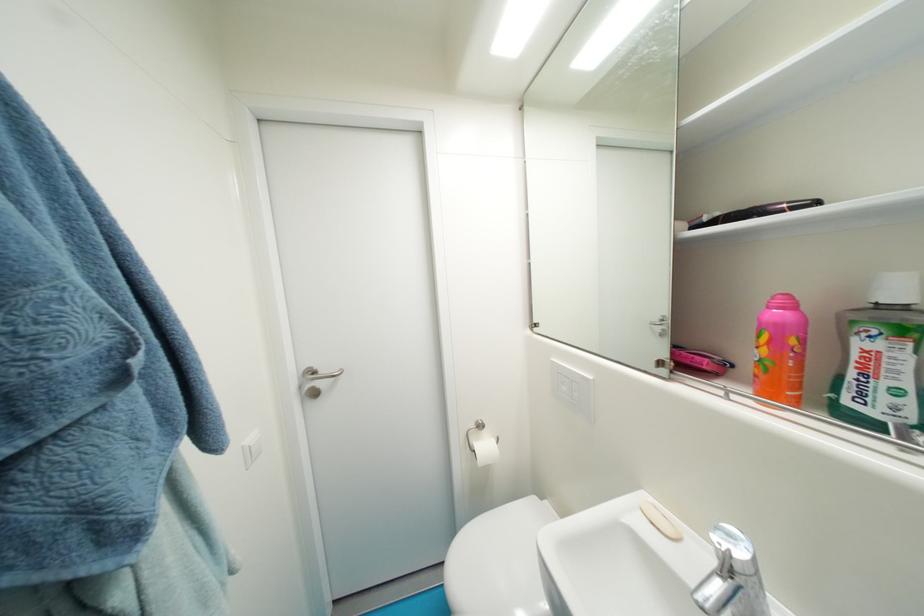
The height and width of the screenshot is (616, 924). What are the coordinates of `clear mouthwash bottle` in the screenshot? It's located at (881, 358).